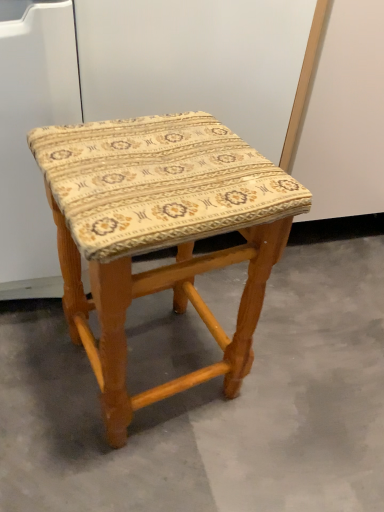
What is the approximate height of wooden stool at center?

The height of wooden stool at center is 17.90 inches.

Find the location of `wooden stool at center`. wooden stool at center is located at coordinates (160, 233).

The height and width of the screenshot is (512, 384). What do you see at coordinates (160, 233) in the screenshot? I see `wooden stool at center` at bounding box center [160, 233].

In order to face beige fabric stool at center, should I rotate leftwards or rightwards?

You should look right and rotate roughly 9.595 degrees.

Image resolution: width=384 pixels, height=512 pixels. Identify the location of beige fabric stool at center. (215, 408).

What do you see at coordinates (215, 408) in the screenshot? I see `beige fabric stool at center` at bounding box center [215, 408].

Where is `wooden stool at center`? wooden stool at center is located at coordinates (160, 233).

From the picture: Considering the positions of objects wooden stool at center and beige fabric stool at center in the image provided, who is more to the left, wooden stool at center or beige fabric stool at center?

Positioned to the left is wooden stool at center.

Which is behind, wooden stool at center or beige fabric stool at center?

beige fabric stool at center.

Is point (139, 182) positioned after point (360, 466)?

That is False.

From the image's perspective, is wooden stool at center located above or below beige fabric stool at center?

Based on their image positions, wooden stool at center is located above beige fabric stool at center.

Consider the image. From a real-world perspective, which object stands above the other?

wooden stool at center is physically above.

Which of these two, wooden stool at center or beige fabric stool at center, is wider?

Wider between the two is beige fabric stool at center.

Does wooden stool at center have a greater height compared to beige fabric stool at center?

Yes, wooden stool at center is taller than beige fabric stool at center.

Which of these two, wooden stool at center or beige fabric stool at center, is smaller?

Smaller between the two is beige fabric stool at center.

Is beige fabric stool at center a part of wooden stool at center?

That's incorrect, beige fabric stool at center is not inside wooden stool at center.

Are wooden stool at center and beige fabric stool at center making contact?

There is a gap between wooden stool at center and beige fabric stool at center.

Is wooden stool at center positioned with its back to beige fabric stool at center?

No, wooden stool at center is not facing the opposite direction of beige fabric stool at center.

Can you tell me how much wooden stool at center and beige fabric stool at center differ in facing direction?

The angular difference between wooden stool at center and beige fabric stool at center is 99.9 degrees.

How far apart are wooden stool at center and beige fabric stool at center?

wooden stool at center is 9.27 inches from beige fabric stool at center.

Find the location of a particular element. This screenshot has width=384, height=512. concrete below the wooden stool at center (from the image's perspective) is located at coordinates (215, 408).

Based on their positions, is beige fabric stool at center located to the left or right of wooden stool at center?

Based on their positions, beige fabric stool at center is located to the right of wooden stool at center.

Which object is more forward, beige fabric stool at center or wooden stool at center?

wooden stool at center is closer to the camera.

Which is closer to the camera, (323, 412) or (251, 298)?

Point (323, 412).

From the image's perspective, relative to wooden stool at center, is beige fabric stool at center above or below?

beige fabric stool at center is situated lower than wooden stool at center in the image.

From a real-world perspective, is beige fabric stool at center physically above wooden stool at center?

No, from a real-world perspective, beige fabric stool at center is not on top of wooden stool at center.

Is beige fabric stool at center wider or thinner than wooden stool at center?

Clearly, beige fabric stool at center has more width compared to wooden stool at center.

Based on the photo, does beige fabric stool at center have a greater height compared to wooden stool at center?

Answer: No.

Does beige fabric stool at center have a smaller size compared to wooden stool at center?

Yes.

Is beige fabric stool at center positioned beyond the bounds of wooden stool at center?

Absolutely, beige fabric stool at center is external to wooden stool at center.

Is beige fabric stool at center next to wooden stool at center?

There is a gap between beige fabric stool at center and wooden stool at center.

Could you tell me if beige fabric stool at center is facing wooden stool at center?

No, beige fabric stool at center is not oriented towards wooden stool at center.

The image size is (384, 512). Identify the location of stool on the left of beige fabric stool at center. (160, 233).

Where is `concrete behind the wooden stool at center`? This screenshot has height=512, width=384. concrete behind the wooden stool at center is located at coordinates (215, 408).

In the image, there is a beige fabric stool at center. Where is `stool above it (from the image's perspective)`? The image size is (384, 512). stool above it (from the image's perspective) is located at coordinates (160, 233).